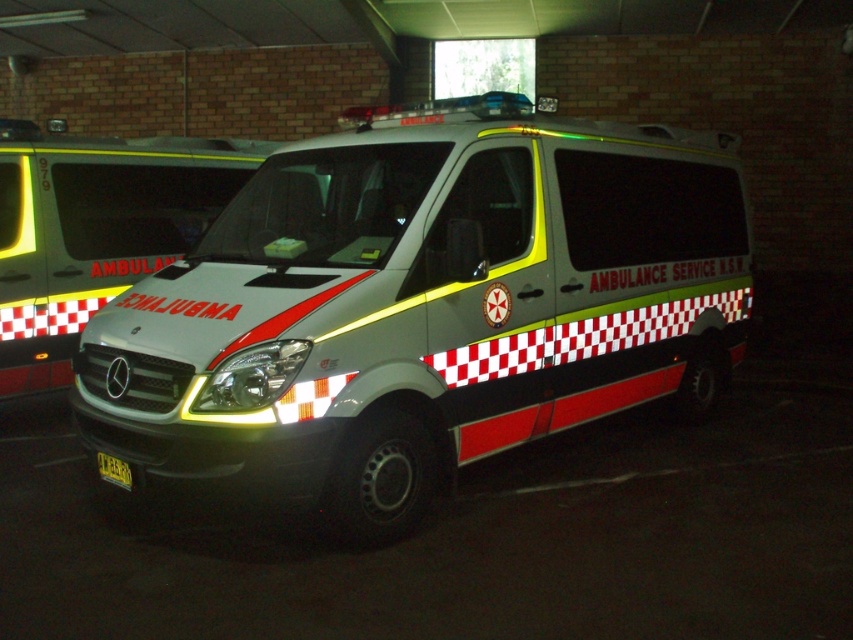
You are a delivery driver who needs to park your truck in the garage where the ambulance and another vehicle are parked. The ambulance is at point (514,218). The other vehicle is at point 0.658, 0.396. Your truck is 20 feet long. Can you safely park your truck between the two vehicles without overlapping them?

The distance between the ambulance at point (514,218) and the other vehicle at point 0.658, 0.396 is 18.87 feet. Since your truck is 20 feet long, which is longer than the available space between them, you cannot park your truck between the two vehicles without overlapping them.

You are a firefighter trying to park your truck in a narrow garage. You see the matte gray ambulance at center and the white glossy ambulance at center. Which ambulance should you avoid moving to make space for your truck?

You should avoid moving the matte gray ambulance at center because it is bigger than the white glossy ambulance at center, so moving the smaller one would require less space.